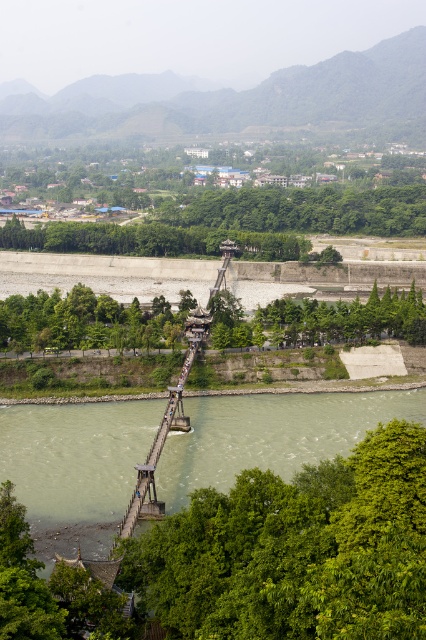
You are a hiker standing at the suspension bridge and want to take a photo of the green leafy tree at lower left and the green leafy trees at center. Which one will appear larger in the photo?

The green leafy tree at lower left will appear larger in the photo because it is much taller than the green leafy trees at center.

You are standing at the suspension bridge and want to take a photo of the green leafy tree at lower left and the green leafy trees at center. Which tree is closer to you?

The green leafy tree at lower left is closer to the viewer than the green leafy trees at center.